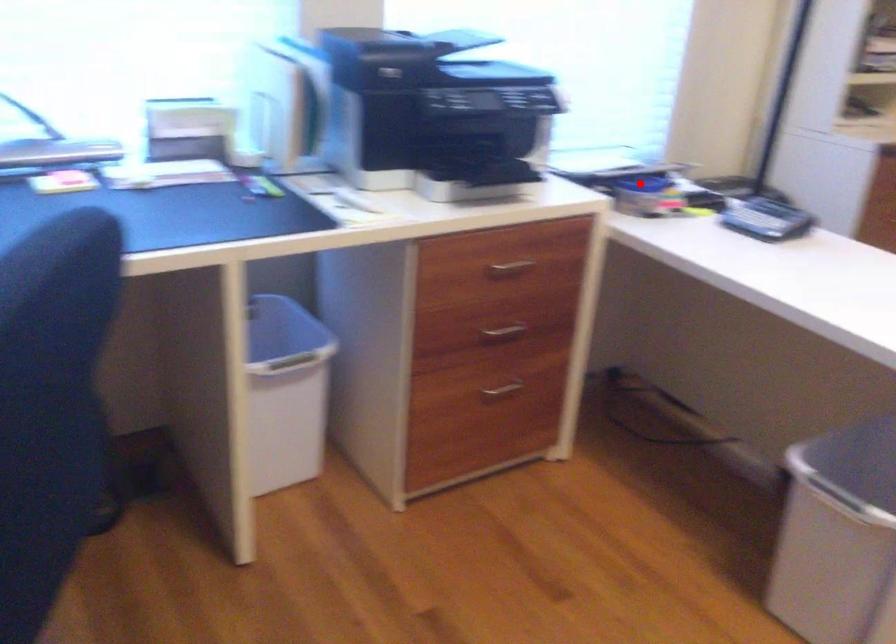
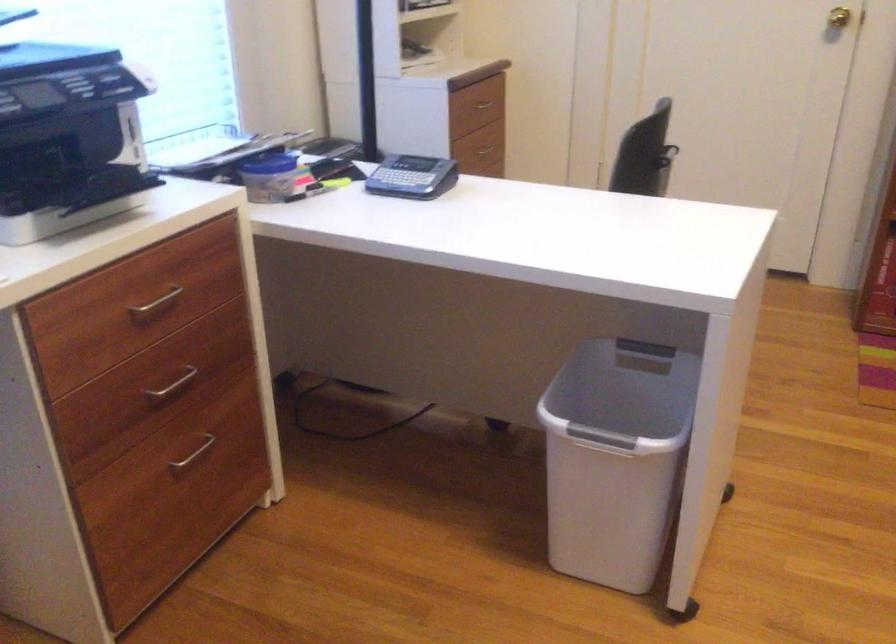
Question: A red point is marked in image1. In image2, is the corresponding 3D point closer to the camera or farther? Reply with the corresponding letter.

Choices:
 (A) The corresponding 3D point is closer.
 (B) The corresponding 3D point is farther.

Answer: (A)